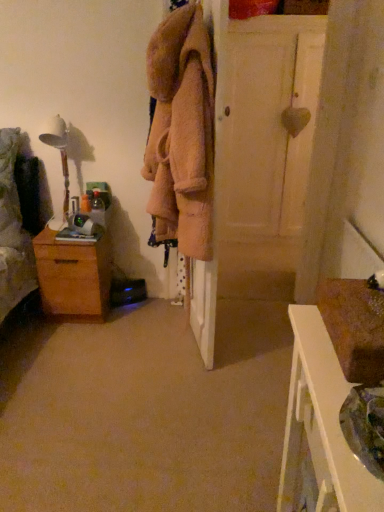
You are a GUI agent. You are given a task and a screenshot of the screen. Output one action in this format:
    pyautogui.click(x=<x>, y=<y>)
    Task: Click on the vacant space in front of wooden chest of drawers at left
    The width and height of the screenshot is (384, 512).
    Given the screenshot: What is the action you would take?
    pyautogui.click(x=66, y=346)